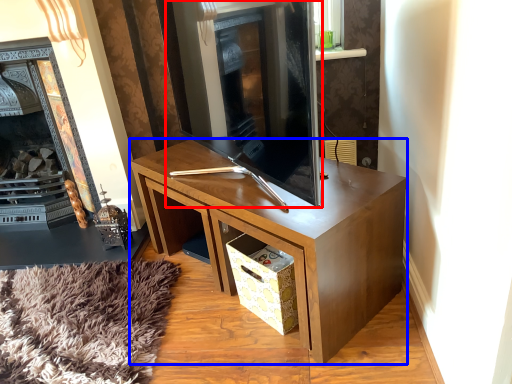
Question: Which of the following is the closest to the observer, fireplace (highlighted by a red box) or desk (highlighted by a blue box)?

Choices:
 (A) fireplace
 (B) desk

Answer: (A)